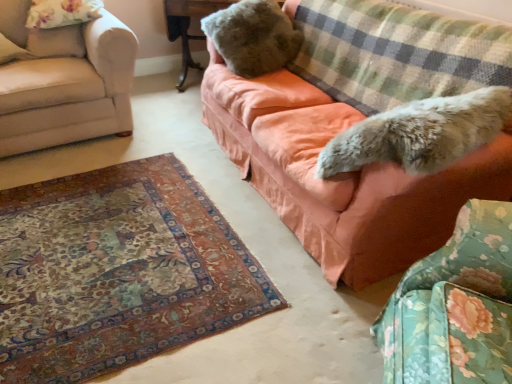
This screenshot has width=512, height=384. In order to click on orange fabric couch at upper right, the 1th studio couch from the right in this screenshot , I will do `click(340, 176)`.

Where is `fuzzy brown teddy bear at upper center`? Image resolution: width=512 pixels, height=384 pixels. fuzzy brown teddy bear at upper center is located at coordinates (253, 37).

Describe the element at coordinates (188, 27) in the screenshot. I see `wooden table at upper center` at that location.

The width and height of the screenshot is (512, 384). Identify the location of fuzzy beige paw at lower right. (420, 133).

At what (x,y) coordinates should I click in order to perform the action: click on orange fabric couch at upper right, the 1th studio couch from the right. Please return your answer as a coordinate pair (x, y). The width and height of the screenshot is (512, 384). Looking at the image, I should click on (340, 176).

How much distance is there between fuzzy beige paw at lower right and beige fabric couch at left, the 2th studio couch in the right-to-left sequence?

fuzzy beige paw at lower right is 1.81 meters away from beige fabric couch at left, the 2th studio couch in the right-to-left sequence.

Between fuzzy beige paw at lower right and beige fabric couch at left, which appears as the 1th studio couch when viewed from the left, which one has larger size?

With larger size is beige fabric couch at left, which appears as the 1th studio couch when viewed from the left.

Choose the correct answer: Is fuzzy beige paw at lower right inside beige fabric couch at left, which appears as the 1th studio couch when viewed from the left, or outside it?

fuzzy beige paw at lower right is not inside beige fabric couch at left, which appears as the 1th studio couch when viewed from the left, it's outside.

Based on their positions, is fuzzy beige paw at lower right located to the left or right of beige fabric couch at left, which appears as the 1th studio couch when viewed from the left?

Clearly, fuzzy beige paw at lower right is on the right of beige fabric couch at left, which appears as the 1th studio couch when viewed from the left, in the image.

Where is `pillow located above the beige fabric couch at left, which appears as the 1th studio couch when viewed from the left (from the image's perspective)`? pillow located above the beige fabric couch at left, which appears as the 1th studio couch when viewed from the left (from the image's perspective) is located at coordinates (62, 13).

Which object is closer to the camera taking this photo, beige fabric couch at left, which appears as the 1th studio couch when viewed from the left, or floral fabric pillow at upper left?

beige fabric couch at left, which appears as the 1th studio couch when viewed from the left, is closer to the camera.

Is beige fabric couch at left, the 2th studio couch in the right-to-left sequence, not near floral fabric pillow at upper left?

No, beige fabric couch at left, the 2th studio couch in the right-to-left sequence, is not far from floral fabric pillow at upper left.

Which point is more distant from viewer, [117,107] or [68,4]?

The point [117,107] is behind.

Would you say orange fabric couch at upper right, acting as the second studio couch starting from the left, is outside fuzzy brown teddy bear at upper center?

Indeed, orange fabric couch at upper right, acting as the second studio couch starting from the left, is completely outside fuzzy brown teddy bear at upper center.

Consider the image. From the image's perspective, is orange fabric couch at upper right, the 1th studio couch from the right, located above or below fuzzy brown teddy bear at upper center?

orange fabric couch at upper right, the 1th studio couch from the right, is situated lower than fuzzy brown teddy bear at upper center in the image.

Is the surface of orange fabric couch at upper right, acting as the second studio couch starting from the left, in direct contact with fuzzy brown teddy bear at upper center?

No, orange fabric couch at upper right, acting as the second studio couch starting from the left, is not making contact with fuzzy brown teddy bear at upper center.

From a real-world perspective, which studio couch is the 1st one underneath the fuzzy brown teddy bear at upper center? Please provide its 2D coordinates.

[(340, 176)]

At what (x,y) coordinates should I click in order to perform the action: click on the 2nd studio couch below the wooden table at upper center (from the image's perspective). Please return your answer as a coordinate pair (x, y). Looking at the image, I should click on (340, 176).

Is wooden table at upper center closer to the viewer compared to orange fabric couch at upper right, the 1th studio couch from the right?

No, wooden table at upper center is behind orange fabric couch at upper right, the 1th studio couch from the right.

Which is further, (231, 1) or (375, 268)?

Positioned behind is point (231, 1).

In the image, is fuzzy beige paw at lower right positioned in front of or behind fuzzy brown teddy bear at upper center?

fuzzy beige paw at lower right is in front of fuzzy brown teddy bear at upper center.

This screenshot has width=512, height=384. What are the coordinates of `animal in front of the fuzzy brown teddy bear at upper center` in the screenshot? It's located at (420, 133).

Based on the photo, between fuzzy beige paw at lower right and fuzzy brown teddy bear at upper center, which one appears on the left side from the viewer's perspective?

fuzzy brown teddy bear at upper center is more to the left.

Between fuzzy beige paw at lower right and fuzzy brown teddy bear at upper center, which one has smaller width?

fuzzy brown teddy bear at upper center is thinner.

Based on the photo, from the image's perspective, which is above, orange fabric couch at upper right, acting as the second studio couch starting from the left, or beige fabric couch at left, which appears as the 1th studio couch when viewed from the left?

From the image's view, beige fabric couch at left, which appears as the 1th studio couch when viewed from the left, is above.

Locate an element on the screen. The width and height of the screenshot is (512, 384). studio couch that is on the left side of orange fabric couch at upper right, acting as the second studio couch starting from the left is located at coordinates (64, 81).

Based on the photo, considering the sizes of objects orange fabric couch at upper right, acting as the second studio couch starting from the left, and beige fabric couch at left, which appears as the 1th studio couch when viewed from the left, in the image provided, who is smaller, orange fabric couch at upper right, acting as the second studio couch starting from the left, or beige fabric couch at left, which appears as the 1th studio couch when viewed from the left,?

beige fabric couch at left, which appears as the 1th studio couch when viewed from the left, is smaller.

Which object is thinner, orange fabric couch at upper right, the 1th studio couch from the right, or beige fabric couch at left, the 2th studio couch in the right-to-left sequence?

Thinner between the two is orange fabric couch at upper right, the 1th studio couch from the right.

Is fluffy fabric swivel chair at lower right beside floral fabric pillow at upper left?

There is a gap between fluffy fabric swivel chair at lower right and floral fabric pillow at upper left.

Measure the distance between fluffy fabric swivel chair at lower right and floral fabric pillow at upper left.

fluffy fabric swivel chair at lower right is 2.49 meters from floral fabric pillow at upper left.

Which is less distant, (425, 302) or (48, 1)?

Positioned in front is point (425, 302).

At what (x,y) coordinates should I click in order to perform the action: click on swivel chair on the right of floral fabric pillow at upper left. Please return your answer as a coordinate pair (x, y). Image resolution: width=512 pixels, height=384 pixels. Looking at the image, I should click on (454, 307).

Starting from the fuzzy beige paw at lower right, which studio couch is the 2nd one to the left? Please provide its 2D coordinates.

[(64, 81)]

The height and width of the screenshot is (384, 512). There is a floral fabric pillow at upper left. What are the coordinates of `the 2nd studio couch below it (from a real-world perspective)` in the screenshot? It's located at (64, 81).

Considering their positions, is fluffy fabric swivel chair at lower right positioned closer to fuzzy beige paw at lower right than checkered fabric blanket at upper right?

fluffy fabric swivel chair at lower right is closer to fuzzy beige paw at lower right.

When comparing their distances from fuzzy beige paw at lower right, does checkered fabric blanket at upper right or beige fabric couch at left, which appears as the 1th studio couch when viewed from the left, seem further?

Based on the image, beige fabric couch at left, which appears as the 1th studio couch when viewed from the left, appears to be further to fuzzy beige paw at lower right.

From the picture: Which object lies nearer to the anchor point floral fabric pillow at upper left, fuzzy beige paw at lower right or beige fabric couch at left, which appears as the 1th studio couch when viewed from the left?

beige fabric couch at left, which appears as the 1th studio couch when viewed from the left, lies closer to floral fabric pillow at upper left than the other object.

Estimate the real-world distances between objects in this image. Which object is closer to beige fabric couch at left, which appears as the 1th studio couch when viewed from the left, fluffy fabric swivel chair at lower right or orange fabric couch at upper right, the 1th studio couch from the right?

Based on the image, orange fabric couch at upper right, the 1th studio couch from the right, appears to be nearer to beige fabric couch at left, which appears as the 1th studio couch when viewed from the left.

When comparing their distances from checkered fabric blanket at upper right, does beige fabric couch at left, which appears as the 1th studio couch when viewed from the left, or fuzzy beige paw at lower right seem further?

beige fabric couch at left, which appears as the 1th studio couch when viewed from the left, lies further to checkered fabric blanket at upper right than the other object.

Which object lies nearer to the anchor point beige fabric couch at left, which appears as the 1th studio couch when viewed from the left, fluffy fabric swivel chair at lower right or wooden table at upper center?

wooden table at upper center lies closer to beige fabric couch at left, which appears as the 1th studio couch when viewed from the left, than the other object.

Which object lies nearer to the anchor point fuzzy beige paw at lower right, checkered fabric blanket at upper right or orange fabric couch at upper right, the 1th studio couch from the right?

Based on the image, orange fabric couch at upper right, the 1th studio couch from the right, appears to be nearer to fuzzy beige paw at lower right.

Estimate the real-world distances between objects in this image. Which object is further from fluffy fabric swivel chair at lower right, wooden table at upper center or checkered fabric blanket at upper right?

wooden table at upper center lies further to fluffy fabric swivel chair at lower right than the other object.

This screenshot has width=512, height=384. In order to click on studio couch between checkered fabric blanket at upper right and fluffy fabric swivel chair at lower right from top to bottom in this screenshot , I will do `click(340, 176)`.

Where is `throw pillow situated between floral fabric pillow at upper left and orange fabric couch at upper right, the 1th studio couch from the right, from left to right`? Image resolution: width=512 pixels, height=384 pixels. throw pillow situated between floral fabric pillow at upper left and orange fabric couch at upper right, the 1th studio couch from the right, from left to right is located at coordinates (253, 37).

Identify the location of throw pillow between beige fabric couch at left, which appears as the 1th studio couch when viewed from the left, and orange fabric couch at upper right, acting as the second studio couch starting from the left, in the horizontal direction. This screenshot has height=384, width=512. (253, 37).

This screenshot has height=384, width=512. Find the location of `animal between fluffy fabric swivel chair at lower right and wooden table at upper center in the front-back direction`. animal between fluffy fabric swivel chair at lower right and wooden table at upper center in the front-back direction is located at coordinates (420, 133).